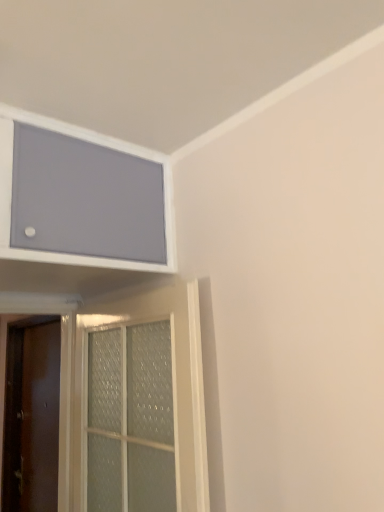
Question: From the image's perspective, does matte gray screen at upper left appear higher than clear glass door at lower left, which is counted as the first door, starting from the right?

Choices:
 (A) no
 (B) yes

Answer: (B)

Question: Considering the relative positions of matte gray screen at upper left and clear glass door at lower left, acting as the 2th door starting from the back, in the image provided, is matte gray screen at upper left to the left of clear glass door at lower left, acting as the 2th door starting from the back, from the viewer's perspective?

Choices:
 (A) no
 (B) yes

Answer: (B)

Question: Considering the relative sizes of matte gray screen at upper left and clear glass door at lower left, which is counted as the first door, starting from the right, in the image provided, is matte gray screen at upper left taller than clear glass door at lower left, which is counted as the first door, starting from the right,?

Choices:
 (A) yes
 (B) no

Answer: (B)

Question: Is matte gray screen at upper left smaller than clear glass door at lower left, acting as the 2th door starting from the back?

Choices:
 (A) no
 (B) yes

Answer: (A)

Question: Considering the relative sizes of matte gray screen at upper left and clear glass door at lower left, which is counted as the first door, starting from the right, in the image provided, is matte gray screen at upper left thinner than clear glass door at lower left, which is counted as the first door, starting from the right,?

Choices:
 (A) yes
 (B) no

Answer: (B)

Question: Considering the relative sizes of matte gray screen at upper left and clear glass door at lower left, acting as the 2th door starting from the back, in the image provided, is matte gray screen at upper left wider than clear glass door at lower left, acting as the 2th door starting from the back,?

Choices:
 (A) yes
 (B) no

Answer: (A)

Question: Can you confirm if clear glass door at lower left, acting as the 2th door starting from the back, is positioned to the right of brown matte door at left, the second door from the front?

Choices:
 (A) no
 (B) yes

Answer: (B)

Question: Is clear glass door at lower left, which is counted as the first door, starting from the right, smaller than brown matte door at left, positioned as the 1th door in left-to-right order?

Choices:
 (A) no
 (B) yes

Answer: (A)

Question: Is brown matte door at left, the second door from the front, a part of clear glass door at lower left, which is counted as the first door, starting from the right?

Choices:
 (A) no
 (B) yes

Answer: (A)

Question: Does clear glass door at lower left, acting as the 2th door starting from the back, turn towards brown matte door at left, marked as the 1th door in a back-to-front arrangement?

Choices:
 (A) yes
 (B) no

Answer: (B)

Question: From the image's perspective, is clear glass door at lower left, positioned as the 2th door in left-to-right order, over brown matte door at left, which appears as the second door when viewed from the right?

Choices:
 (A) yes
 (B) no

Answer: (A)

Question: Considering the relative positions of clear glass door at lower left, which is counted as the first door, starting from the front, and brown matte door at left, the second door from the front, in the image provided, is clear glass door at lower left, which is counted as the first door, starting from the front, in front of brown matte door at left, the second door from the front,?

Choices:
 (A) yes
 (B) no

Answer: (A)

Question: Can you confirm if clear glass door at lower left, acting as the 2th door starting from the back, is positioned to the right of matte gray screen at upper left?

Choices:
 (A) yes
 (B) no

Answer: (A)